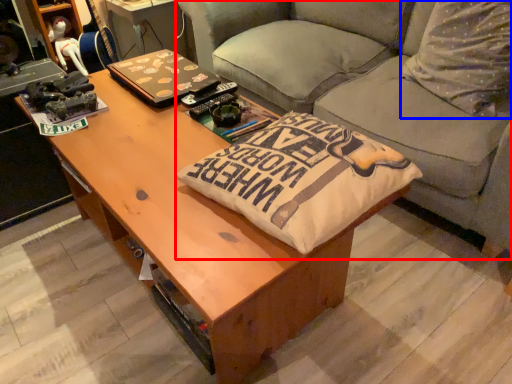
Question: Which point is further to the camera, studio couch (highlighted by a red box) or throw pillow (highlighted by a blue box)?

Choices:
 (A) studio couch
 (B) throw pillow

Answer: (B)